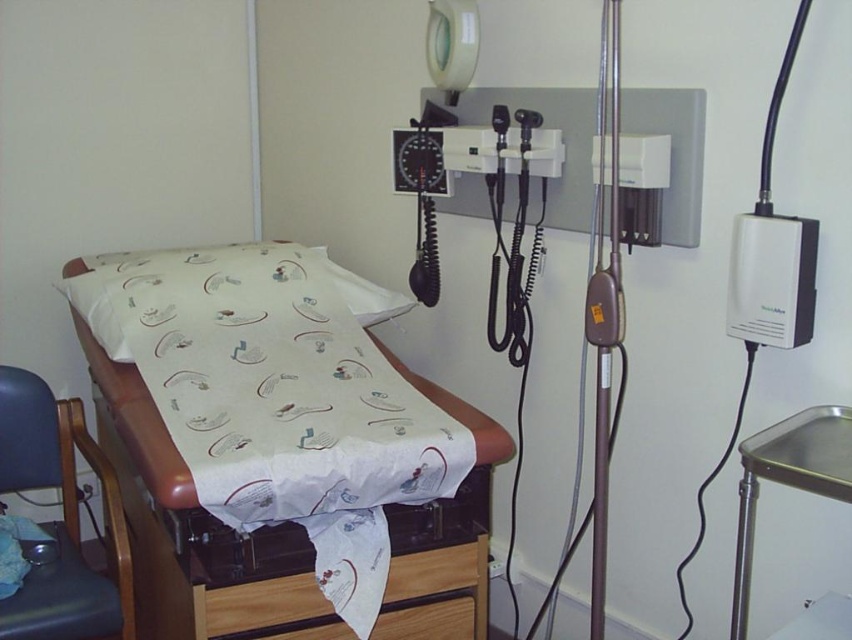
Between white printed fabric at center and metallic tray at right, which one appears on the left side from the viewer's perspective?

white printed fabric at center

This screenshot has width=852, height=640. What do you see at coordinates (274, 429) in the screenshot?
I see `white printed fabric at center` at bounding box center [274, 429].

I want to click on white printed fabric at center, so click(274, 429).

Does blue fabric chair at lower left have a smaller size compared to wooden drawer at lower center?

No.

Is point (121, 566) in front of point (326, 627)?

That is False.

Find the location of `blue fabric chair at lower left`. blue fabric chair at lower left is located at coordinates (60, 522).

Can you confirm if white printed fabric at center is positioned below wooden drawer at lower center?

No.

Between white printed fabric at center and wooden drawer at lower center, which one is positioned higher?

white printed fabric at center

The height and width of the screenshot is (640, 852). What do you see at coordinates (274, 429) in the screenshot? I see `white printed fabric at center` at bounding box center [274, 429].

Where is `white printed fabric at center`? This screenshot has height=640, width=852. white printed fabric at center is located at coordinates (274, 429).